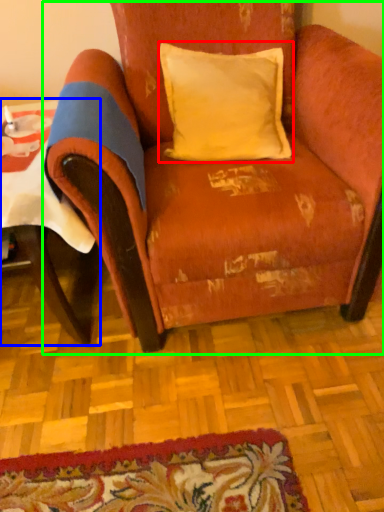
Question: Which is farther away from pillow (highlighted by a red box)? table (highlighted by a blue box) or chair (highlighted by a green box)?

Choices:
 (A) table
 (B) chair

Answer: (A)